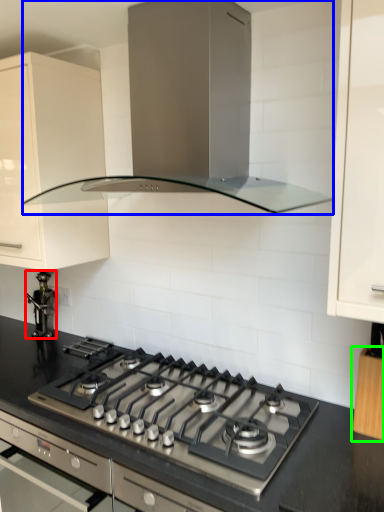
Question: Which object is the closest to the appliance (highlighted by a red box)? Choose among these: home appliance (highlighted by a blue box) or cabinetry (highlighted by a green box).

Choices:
 (A) home appliance
 (B) cabinetry

Answer: (A)